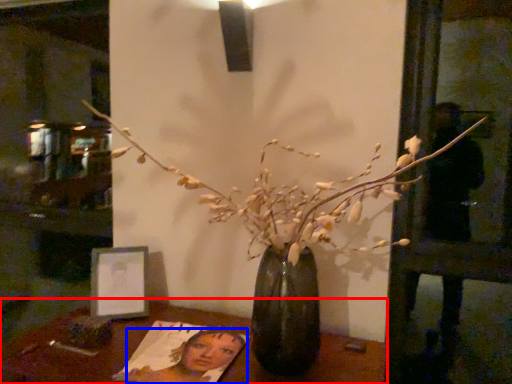
Question: Which object is further to the camera taking this photo, table (highlighted by a red box) or woman (highlighted by a blue box)?

Choices:
 (A) table
 (B) woman

Answer: (B)